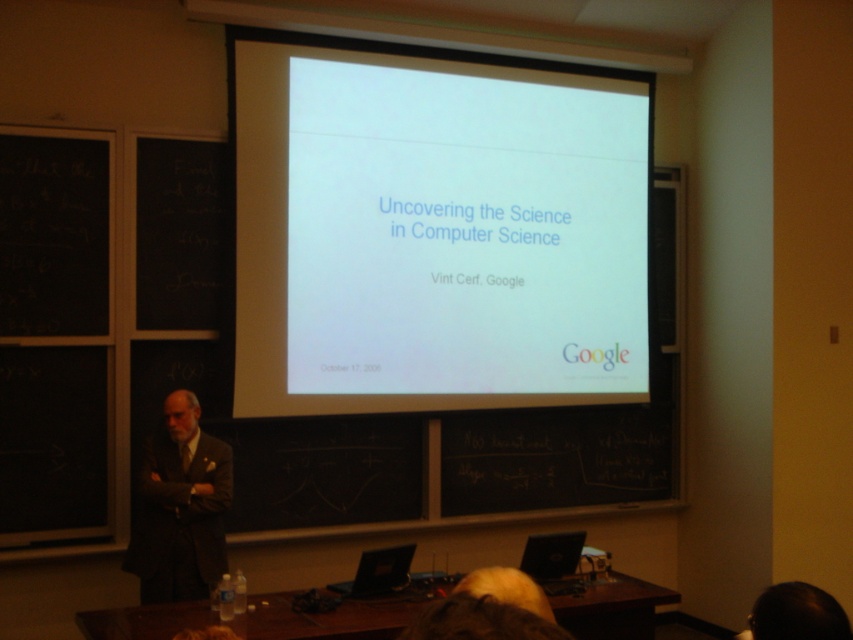
Can you confirm if white matte projector screen at upper center is shorter than brown woolen suit at left?

No.

Who is taller, white matte projector screen at upper center or brown woolen suit at left?

white matte projector screen at upper center is taller.

Identify the location of white matte projector screen at upper center. (434, 234).

Who is more distant from viewer, (767, 630) or (480, 570)?

The point (480, 570) is more distant.

Does dark hair at upper center lie behind blonde hair at lower center?

Yes, dark hair at upper center is behind blonde hair at lower center.

Identify the location of dark hair at upper center. This screenshot has height=640, width=853. (798, 612).

This screenshot has height=640, width=853. I want to click on dark hair at upper center, so click(x=798, y=612).

Based on the photo, does brown woolen suit at left have a lesser width compared to dark hair at upper center?

In fact, brown woolen suit at left might be wider than dark hair at upper center.

Is point (171, 506) positioned after point (769, 630)?

Yes.

Does point (178, 540) lie in front of point (775, 627)?

No, (178, 540) is further to viewer.

At what (x,y) coordinates should I click in order to perform the action: click on brown woolen suit at left. Please return your answer as a coordinate pair (x, y). Looking at the image, I should click on [178, 518].